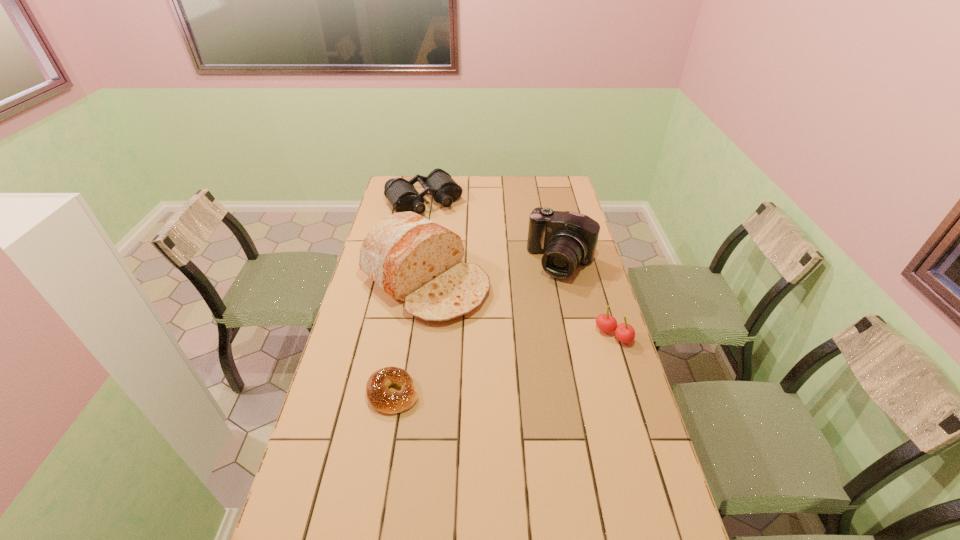
Locate an element on the screen. The height and width of the screenshot is (540, 960). binoculars positioned at the left edge is located at coordinates (402, 195).

Where is `cherry present at the right edge`? cherry present at the right edge is located at coordinates (625, 333).

Locate an element on the screen. This screenshot has width=960, height=540. camera that is at the right edge is located at coordinates (567, 239).

Locate an element on the screen. The image size is (960, 540). object present at the far left corner is located at coordinates (402, 195).

Image resolution: width=960 pixels, height=540 pixels. In the image, there is a desktop. Find the location of `vacant space at the far edge`. vacant space at the far edge is located at coordinates (489, 188).

This screenshot has height=540, width=960. What are the coordinates of `vacant space at the left edge of the desktop` in the screenshot? It's located at (386, 298).

Where is `blank space at the right edge of the desktop`? This screenshot has height=540, width=960. blank space at the right edge of the desktop is located at coordinates (546, 207).

At what (x,y) coordinates should I click in order to perform the action: click on vacant position at the far right corner of the desktop. Please return your answer as a coordinate pair (x, y). This screenshot has width=960, height=540. Looking at the image, I should click on (549, 186).

Where is `vacant space that is in between the camera and the bread`? The height and width of the screenshot is (540, 960). vacant space that is in between the camera and the bread is located at coordinates (493, 271).

Where is `free space between the bread and the nearest object`? Image resolution: width=960 pixels, height=540 pixels. free space between the bread and the nearest object is located at coordinates (410, 337).